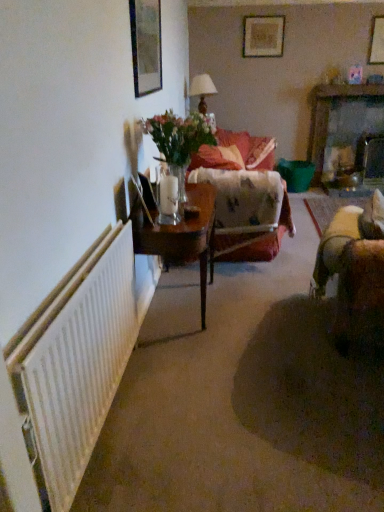
Question: Looking at their shapes, would you say fluffy fabric couch at center is wider or thinner than white ribbed radiator at left?

Choices:
 (A) wide
 (B) thin

Answer: (A)

Question: Is point (241, 156) positioned closer to the camera than point (84, 354)?

Choices:
 (A) farther
 (B) closer

Answer: (A)

Question: Estimate the real-world distances between objects in this image. Which object is closer to the floral-patterned fabric couch at center?

Choices:
 (A) wooden picture frame at upper center, the 3th picture frame from the bottom
 (B) clear glass vase at center
 (C) wooden table at left
 (D) fluffy fabric couch at center
 (E) wooden dresser at upper right

Answer: (D)

Question: Which object is the closest to the wooden table at left?

Choices:
 (A) clear glass vase at center
 (B) wooden picture frame at upper center, the first picture frame from the back
 (C) fluffy fabric couch at center
 (D) floral-patterned fabric couch at center
 (E) wooden picture frame at upper right, which ranks as the 1th picture frame in right-to-left order

Answer: (A)